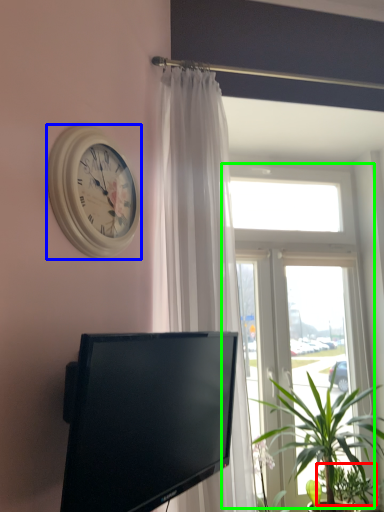
Question: Considering the real-world distances, which object is closest to plant (highlighted by a red box)? wall clock (highlighted by a blue box) or window (highlighted by a green box).

Choices:
 (A) wall clock
 (B) window

Answer: (B)